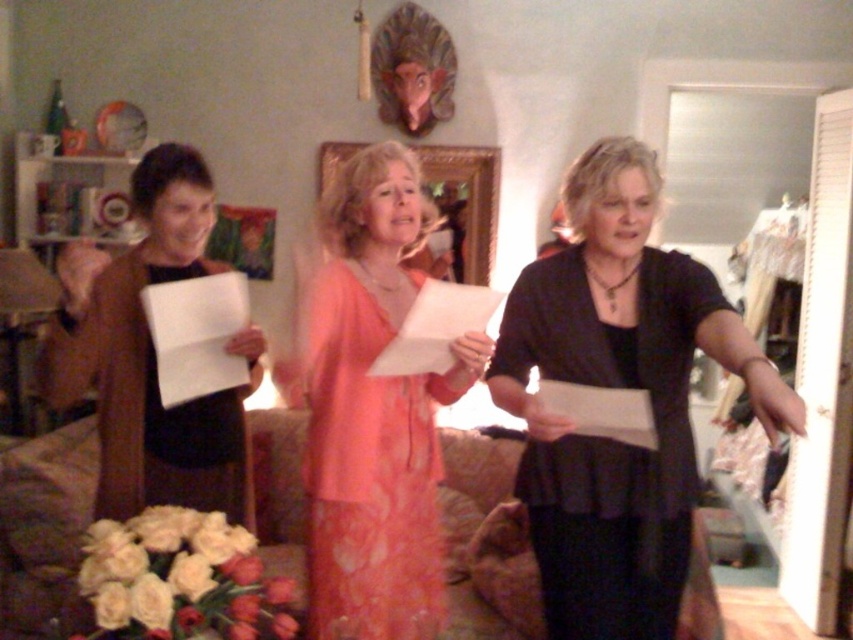
You are at a social event in the living room and want to hand a gift to the person wearing the matte peach dress at center. If you are standing 3 feet away from the dress, can you reach them without moving closer?

The matte peach dress at center is 5.67 feet away from the viewer. Since you are 3 feet away from the dress, you are actually 2.67 feet away from the dress, so yes, you can reach them without moving closer.

You are planning to take a photo of the two dresses at the event. Which dress should you focus on first if you want to capture both the black matte dress at center and the matte peach dress at center in your shot?

The black matte dress at center is located above the matte peach dress at center, so you should focus on the black matte dress at center first to ensure both are in frame.

You are organizing a closet and have two dresses hanging side by side. The black matte dress at center and the matte peach dress at center. Which dress is wider?

The black matte dress at center is wider than the matte peach dress at center according to the description.